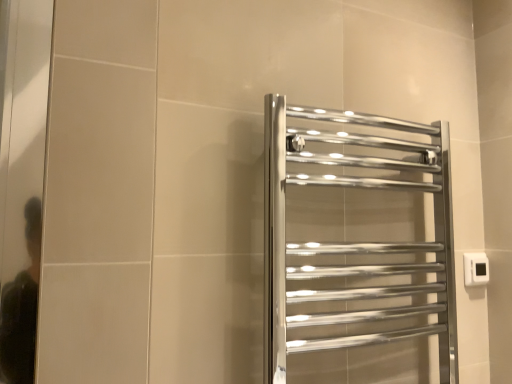
Identify the location of white plastic electric outlet at right. Image resolution: width=512 pixels, height=384 pixels. (475, 269).

Describe the element at coordinates (475, 269) in the screenshot. I see `white plastic electric outlet at right` at that location.

Measure the distance between point (329, 328) and camera.

Point (329, 328) and camera are 37.72 inches apart.

The height and width of the screenshot is (384, 512). Describe the element at coordinates (356, 249) in the screenshot. I see `polished chrome towel rack at center` at that location.

Where is `polished chrome towel rack at center`? The image size is (512, 384). polished chrome towel rack at center is located at coordinates (356, 249).

From the picture: What is the approximate width of polished chrome towel rack at center?

polished chrome towel rack at center is 4.42 inches in width.

Identify the location of white plastic electric outlet at right. (475, 269).

Can you confirm if polished chrome towel rack at center is positioned to the left of white plastic electric outlet at right?

Indeed, polished chrome towel rack at center is positioned on the left side of white plastic electric outlet at right.

Consider the image. Between polished chrome towel rack at center and white plastic electric outlet at right, which one is positioned behind?

white plastic electric outlet at right is more distant.

Does point (378, 178) come behind point (467, 282)?

No, it is not.

From the image's perspective, which is below, polished chrome towel rack at center or white plastic electric outlet at right?

From the image's view, white plastic electric outlet at right is below.

From a real-world perspective, is polished chrome towel rack at center on top of white plastic electric outlet at right?

Correct, in the physical world, polished chrome towel rack at center is higher than white plastic electric outlet at right.

Considering the sizes of objects polished chrome towel rack at center and white plastic electric outlet at right in the image provided, who is wider, polished chrome towel rack at center or white plastic electric outlet at right?

polished chrome towel rack at center.

In terms of height, does polished chrome towel rack at center look taller or shorter compared to white plastic electric outlet at right?

Considering their sizes, polished chrome towel rack at center has more height than white plastic electric outlet at right.

Who is bigger, polished chrome towel rack at center or white plastic electric outlet at right?

With larger size is polished chrome towel rack at center.

Consider the image. Is polished chrome towel rack at center not within white plastic electric outlet at right?

Absolutely, polished chrome towel rack at center is external to white plastic electric outlet at right.

Are polished chrome towel rack at center and white plastic electric outlet at right far apart?

No, polished chrome towel rack at center is in close proximity to white plastic electric outlet at right.

Is polished chrome towel rack at center looking in the opposite direction of white plastic electric outlet at right?

Result: No, white plastic electric outlet at right is not at the back of polished chrome towel rack at center.

How many degrees apart are the facing directions of polished chrome towel rack at center and white plastic electric outlet at right?

polished chrome towel rack at center and white plastic electric outlet at right are facing 2.11 degrees away from each other.

Measure the distance from polished chrome towel rack at center to white plastic electric outlet at right.

They are 35.26 centimeters apart.

Identify the location of towel rack above the white plastic electric outlet at right (from the image's perspective). Image resolution: width=512 pixels, height=384 pixels. (356, 249).

Considering the positions of objects white plastic electric outlet at right and polished chrome towel rack at center in the image provided, who is more to the right, white plastic electric outlet at right or polished chrome towel rack at center?

Positioned to the right is white plastic electric outlet at right.

Considering the relative positions of white plastic electric outlet at right and polished chrome towel rack at center in the image provided, is white plastic electric outlet at right behind polished chrome towel rack at center?

Yes, white plastic electric outlet at right is behind polished chrome towel rack at center.

Is point (479, 266) positioned behind point (386, 185)?

Yes, it is behind point (386, 185).

From the image's perspective, would you say white plastic electric outlet at right is positioned over polished chrome towel rack at center?

Incorrect, from the image's perspective, white plastic electric outlet at right is lower than polished chrome towel rack at center.

From a real-world perspective, which is physically above, white plastic electric outlet at right or polished chrome towel rack at center?

In real-world perspective, polished chrome towel rack at center is above.

Is white plastic electric outlet at right wider or thinner than polished chrome towel rack at center?

Considering their sizes, white plastic electric outlet at right looks slimmer than polished chrome towel rack at center.

Looking at this image, considering the sizes of white plastic electric outlet at right and polished chrome towel rack at center in the image, is white plastic electric outlet at right taller or shorter than polished chrome towel rack at center?

In the image, white plastic electric outlet at right appears to be shorter than polished chrome towel rack at center.

Consider the image. Is white plastic electric outlet at right smaller than polished chrome towel rack at center?

Yes.

Looking at this image, is white plastic electric outlet at right situated inside polished chrome towel rack at center or outside?

white plastic electric outlet at right cannot be found inside polished chrome towel rack at center.

Are white plastic electric outlet at right and polished chrome towel rack at center located far from each other?

No, white plastic electric outlet at right is not far away from polished chrome towel rack at center.

Could you tell me if white plastic electric outlet at right is facing polished chrome towel rack at center?

No, white plastic electric outlet at right is not aimed at polished chrome towel rack at center.

Locate an element on the screen. Image resolution: width=512 pixels, height=384 pixels. electric outlet on the right of polished chrome towel rack at center is located at coordinates (475, 269).

This screenshot has width=512, height=384. Identify the location of electric outlet below the polished chrome towel rack at center (from the image's perspective). 475,269.

I want to click on towel rack on the left of the white plastic electric outlet at right, so click(356, 249).